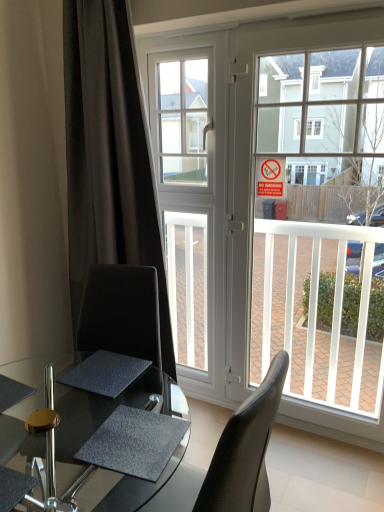
Locate an element on the screen. This screenshot has height=512, width=384. free spot above white glass window at center (from a real-world perspective) is located at coordinates (178, 42).